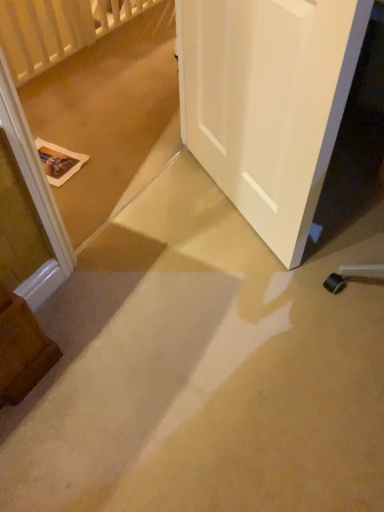
Question: Can you confirm if white wooden balustrade at upper left is smaller than beige carpet at lower center?

Choices:
 (A) no
 (B) yes

Answer: (B)

Question: Can you confirm if white wooden balustrade at upper left is bigger than beige carpet at lower center?

Choices:
 (A) no
 (B) yes

Answer: (A)

Question: Is white wooden balustrade at upper left shorter than beige carpet at lower center?

Choices:
 (A) yes
 (B) no

Answer: (B)

Question: From the image's perspective, would you say white wooden balustrade at upper left is shown under beige carpet at lower center?

Choices:
 (A) no
 (B) yes

Answer: (A)

Question: Is white wooden balustrade at upper left beside beige carpet at lower center?

Choices:
 (A) yes
 (B) no

Answer: (B)

Question: Considering the positions of point (350, 5) and point (24, 60), is point (350, 5) closer or farther from the camera than point (24, 60)?

Choices:
 (A) closer
 (B) farther

Answer: (A)

Question: Based on their positions, is white matte door at center located to the left or right of white wooden balustrade at upper left?

Choices:
 (A) left
 (B) right

Answer: (B)

Question: Do you think white matte door at center is within white wooden balustrade at upper left, or outside of it?

Choices:
 (A) inside
 (B) outside

Answer: (B)

Question: In terms of width, does white matte door at center look wider or thinner when compared to white wooden balustrade at upper left?

Choices:
 (A) wide
 (B) thin

Answer: (B)

Question: Which is correct: beige carpet at lower center is inside white matte door at center, or outside of it?

Choices:
 (A) outside
 (B) inside

Answer: (A)

Question: Is point (367, 352) positioned closer to the camera than point (183, 22)?

Choices:
 (A) farther
 (B) closer

Answer: (B)

Question: Would you say beige carpet at lower center is to the left or to the right of white matte door at center in the picture?

Choices:
 (A) left
 (B) right

Answer: (B)

Question: From a real-world perspective, relative to white matte door at center, is beige carpet at lower center vertically above or below?

Choices:
 (A) below
 (B) above

Answer: (A)

Question: Is white matte door at center taller or shorter than beige carpet at lower center?

Choices:
 (A) tall
 (B) short

Answer: (A)

Question: Visually, is white matte door at center positioned to the left or to the right of beige carpet at lower center?

Choices:
 (A) left
 (B) right

Answer: (A)